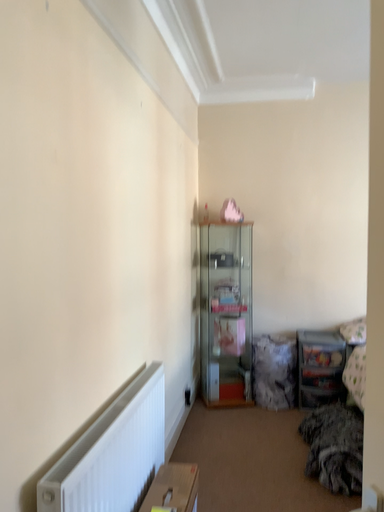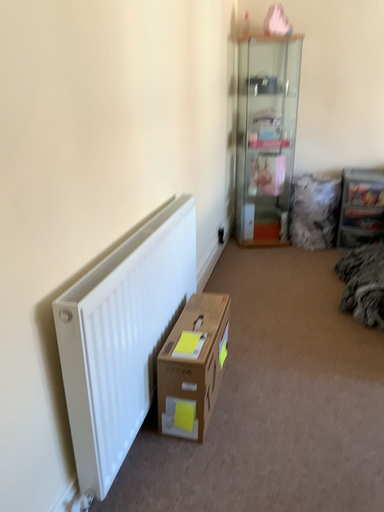
Question: Which way did the camera rotate in the video?

Choices:
 (A) rotated upward
 (B) rotated downward

Answer: (B)